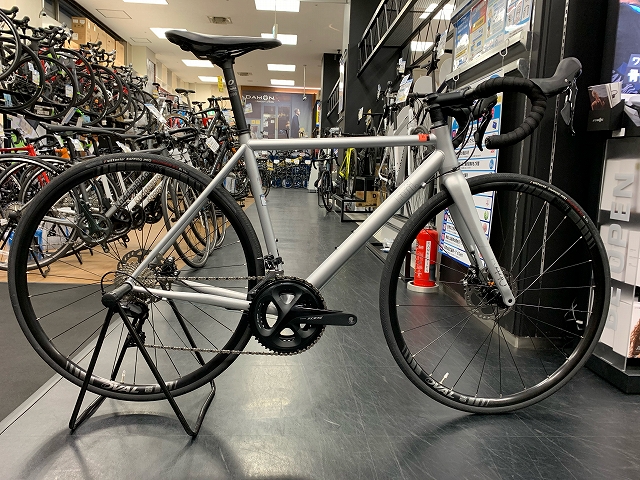
Where is `bench seating`? The width and height of the screenshot is (640, 480). bench seating is located at coordinates (344, 200).